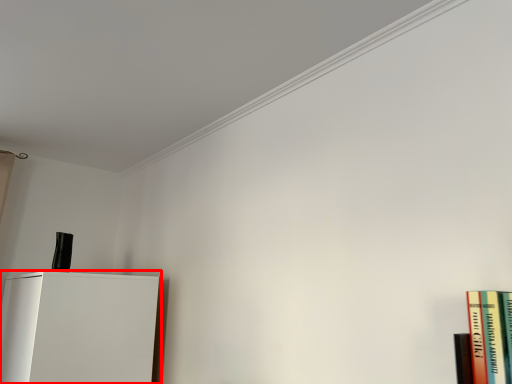
Question: In this image, where is furniture (annotated by the red box) located relative to book?

Choices:
 (A) left
 (B) right

Answer: (A)